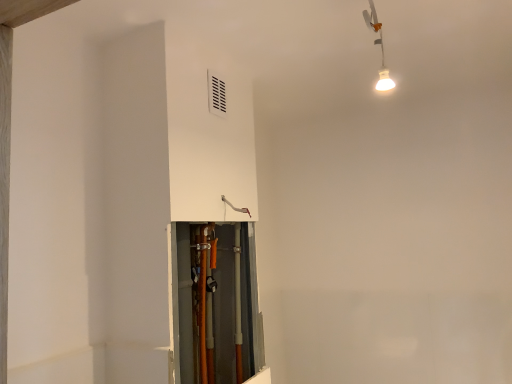
In order to click on orange rubber hose at center in this screenshot , I will do `click(217, 304)`.

The image size is (512, 384). What do you see at coordinates (217, 304) in the screenshot?
I see `orange rubber hose at center` at bounding box center [217, 304].

The image size is (512, 384). Identify the location of orange rubber hose at center. (217, 304).